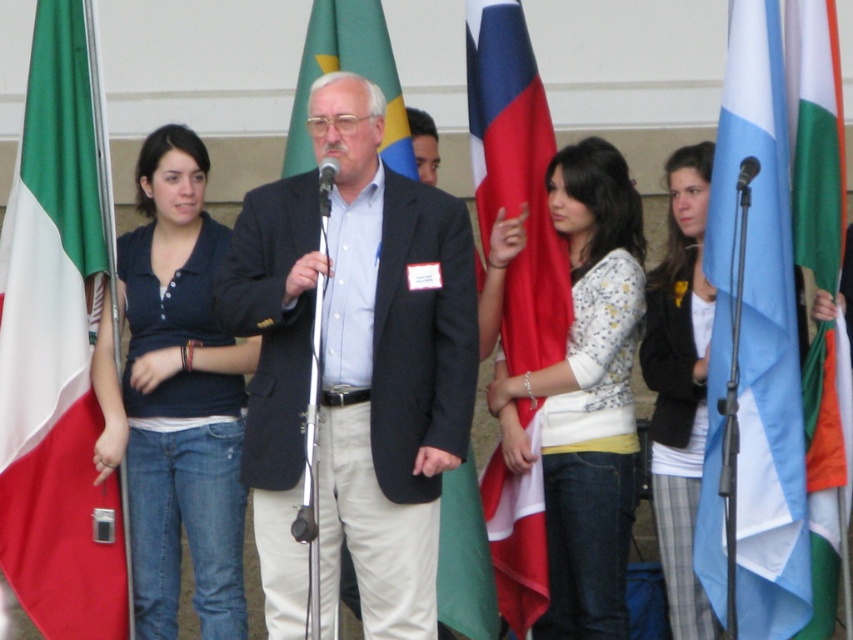
From the picture: You are attending a formal event and notice two flags displayed in the background. The red fabric flag at center and the green fabric flag at center. Which flag is positioned to the right of the other?

The red fabric flag at center is to the right of the green fabric flag at center.

You are a photographer at the event. You need to capture a photo of the dark gray suit at center and the metallic silver microphone at center. Which object is closer to the camera based on their positions?

The dark gray suit at center is positioned under the metallic silver microphone at center, meaning the microphone is closer to the camera than the suit.